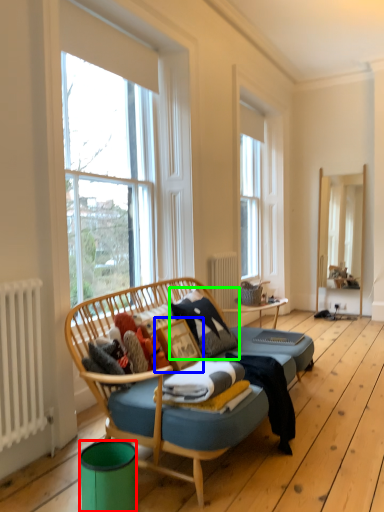
Question: Based on their relative distances, which object is farther from trash bin/can (highlighted by a red box)? Choose from picture frame (highlighted by a blue box) and pillow (highlighted by a green box).

Choices:
 (A) picture frame
 (B) pillow

Answer: (B)